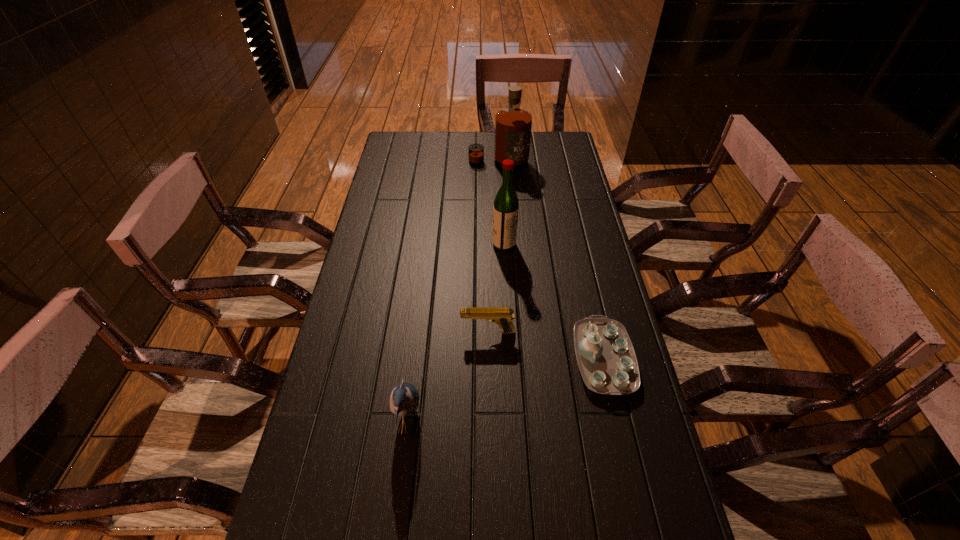
The width and height of the screenshot is (960, 540). What are the coordinates of `the second closest object relative to the leftmost object` in the screenshot? It's located at (606, 358).

This screenshot has height=540, width=960. I want to click on vacant space that satisfies the following two spatial constraints: 1. on the front label of the chinaware; 2. on the right side of the farther liquor, so click(x=509, y=359).

In order to click on vacant space that satisfies the following two spatial constraints: 1. on the front label of the farthest object; 2. on the right side of the chinaware in this screenshot , I will do `click(509, 359)`.

Where is `free space that satisfies the following two spatial constraints: 1. at the barrel of the rightmost object; 2. on the right side of the pistol`? Image resolution: width=960 pixels, height=540 pixels. free space that satisfies the following two spatial constraints: 1. at the barrel of the rightmost object; 2. on the right side of the pistol is located at coordinates (489, 359).

Locate an element on the screen. The height and width of the screenshot is (540, 960). blank space that satisfies the following two spatial constraints: 1. on the label of the nearer liquor; 2. on the right side of the chinaware is located at coordinates (511, 359).

Locate an element on the screen. free space in the image that satisfies the following two spatial constraints: 1. on the front label of the farther liquor; 2. at the barrel of the pistol is located at coordinates point(507,332).

Where is `vacant area that satisfies the following two spatial constraints: 1. on the front label of the farthest object; 2. at the tip of the leftmost object's beak`? vacant area that satisfies the following two spatial constraints: 1. on the front label of the farthest object; 2. at the tip of the leftmost object's beak is located at coordinates (513, 424).